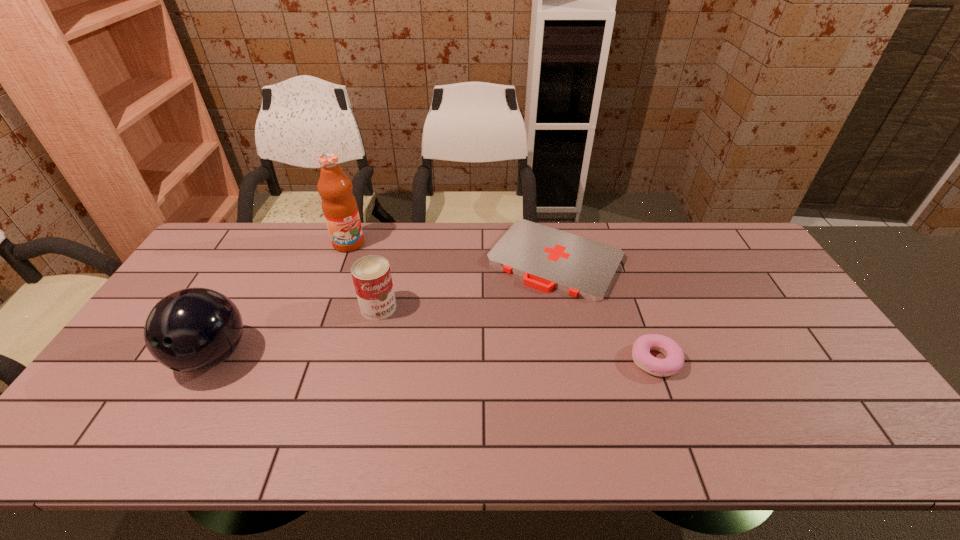
Where is `fruit juice that is at the far edge`? This screenshot has height=540, width=960. fruit juice that is at the far edge is located at coordinates (339, 206).

You are a GUI agent. You are given a task and a screenshot of the screen. Output one action in this format:
    pyautogui.click(x=<x>, y=<y>)
    Task: Click on the object located at the near edge
    This screenshot has width=960, height=540.
    Given the screenshot: What is the action you would take?
    pyautogui.click(x=194, y=329)

Where is `object that is positioned at the left edge`? Image resolution: width=960 pixels, height=540 pixels. object that is positioned at the left edge is located at coordinates (x=194, y=329).

The width and height of the screenshot is (960, 540). I want to click on object positioned at the near left corner, so click(x=194, y=329).

The height and width of the screenshot is (540, 960). I want to click on vacant region at the far edge, so click(381, 249).

Locate an element on the screen. vacant space at the near edge of the desktop is located at coordinates (194, 395).

Identify the location of free space at the right edge. (756, 324).

The image size is (960, 540). In order to click on vacant area at the far left corner in this screenshot , I will do `click(223, 232)`.

Find the location of a particular element. The height and width of the screenshot is (540, 960). vacant point located between the can and the fourth shortest object is located at coordinates (296, 332).

Image resolution: width=960 pixels, height=540 pixels. Find the location of `free space between the shortest object and the can`. free space between the shortest object and the can is located at coordinates (467, 284).